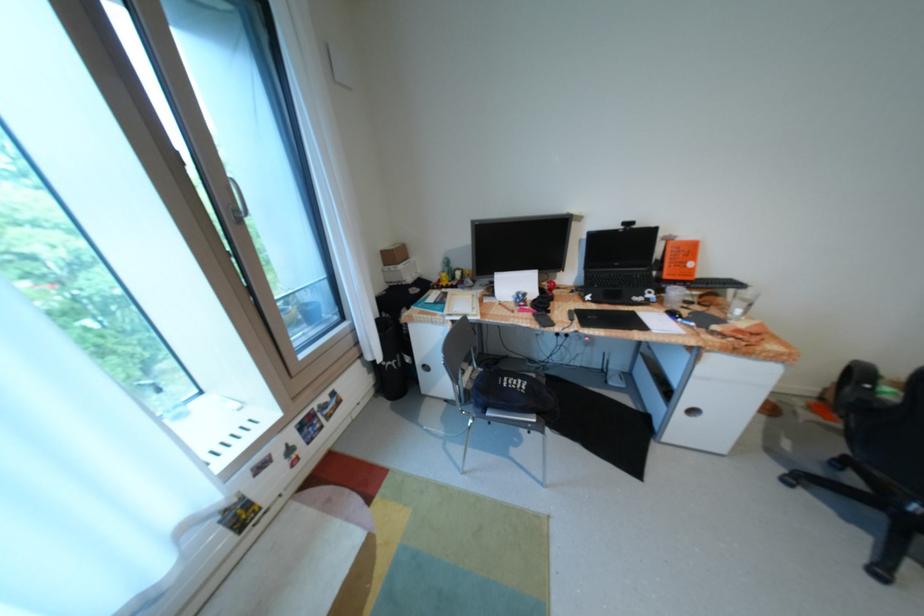
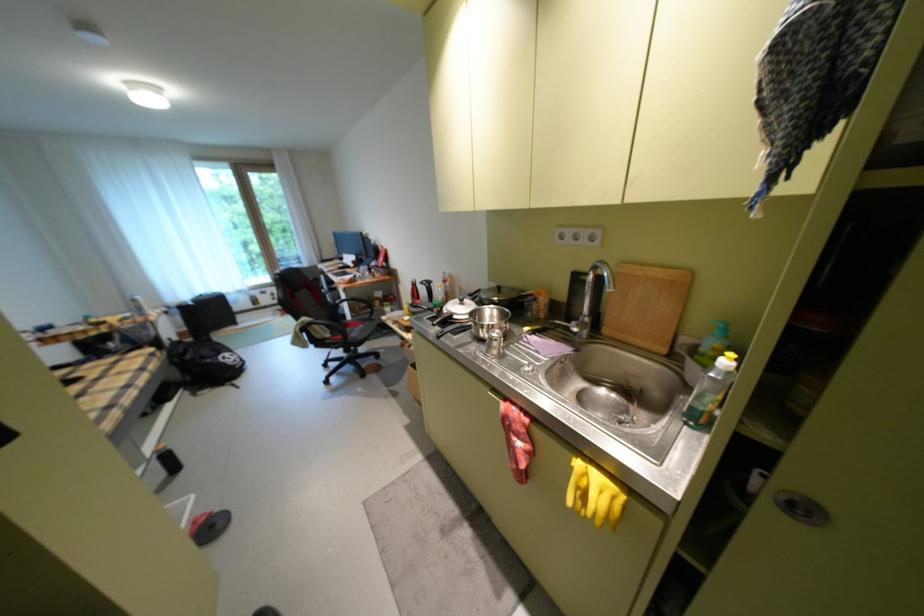
Where in the second image is the point corresponding to the point at 289,455 from the first image?

(280, 294)